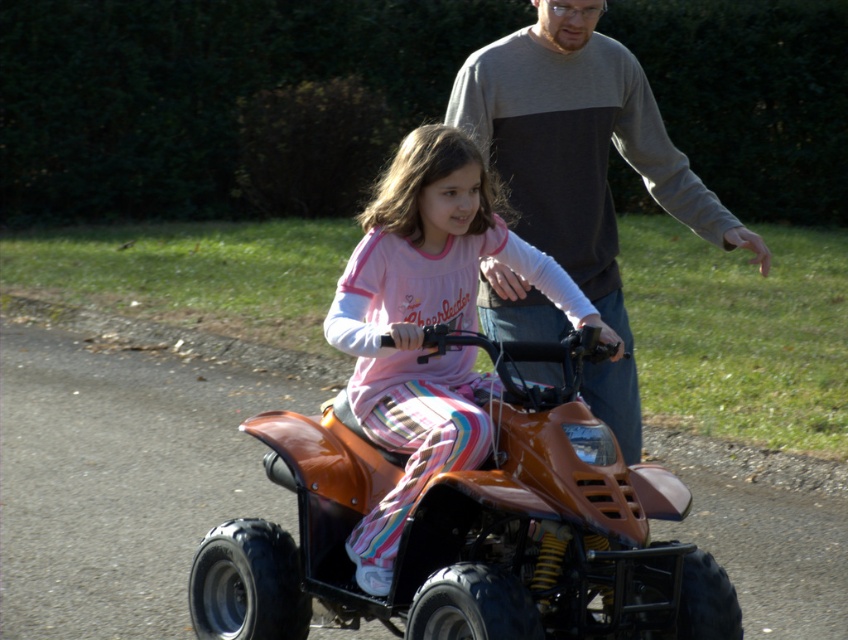
Is orange matte quad bike at center bigger than matte orange quad bike at center?

Yes, orange matte quad bike at center is bigger than matte orange quad bike at center.

How far apart are orange matte quad bike at center and matte orange quad bike at center?

orange matte quad bike at center is 14.82 inches from matte orange quad bike at center.

Which is in front, point (424, 632) or point (419, 198)?

Point (424, 632) is more forward.

Image resolution: width=848 pixels, height=640 pixels. Find the location of `orange matte quad bike at center`. orange matte quad bike at center is located at coordinates tap(469, 529).

Between point (533, 113) and point (352, 406), which one is positioned in front?

Positioned in front is point (352, 406).

Does point (506, 88) lie behind point (424, 420)?

Yes, point (506, 88) is behind point (424, 420).

In order to click on gray/black sweater at upper center in this screenshot , I will do `click(579, 145)`.

Based on the photo, does orange matte quad bike at center come behind gray/black sweater at upper center?

No, it is in front of gray/black sweater at upper center.

Who is more forward, (505,634) or (522,97)?

Point (505,634) is more forward.

Where is `orange matte quad bike at center`? The height and width of the screenshot is (640, 848). orange matte quad bike at center is located at coordinates (469, 529).